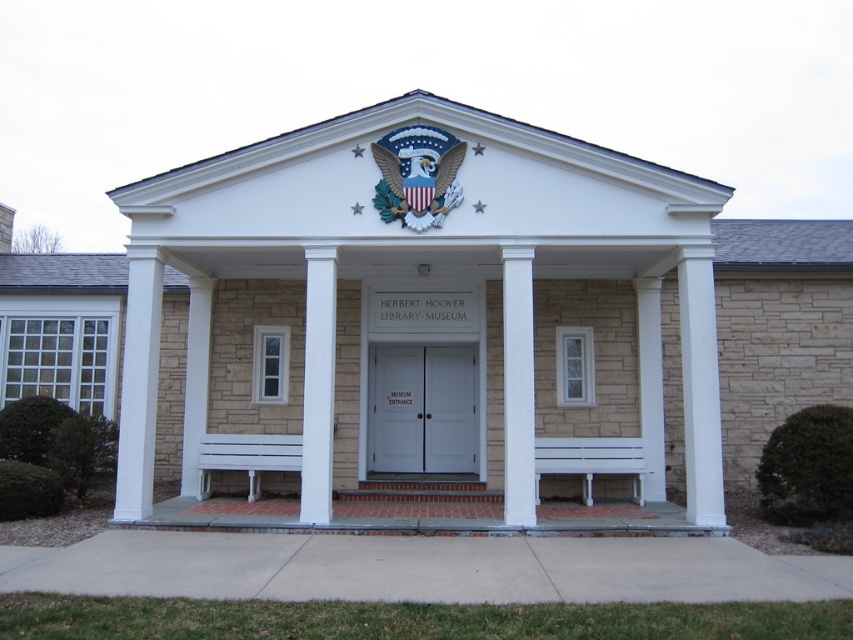
You are standing in front of the Herbert Hoover Library Museum and notice two points on the building facade. The first point is at coordinates point (440, 406) and the second point is at point (525, 449). Which point is closer to you?

Point (440, 406) is closer to you because it is further to the camera than point (525, 449).

You are standing in front of the Herbert Hoover Library Museum and want to enter. You see the white wooden doors at center and the white stone column at left. Which object is more to the left?

The white stone column at left is more to the left side than the white wooden doors at center.